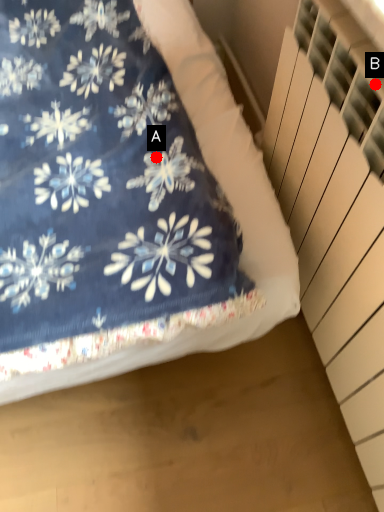
Question: Two points are circled on the image, labeled by A and B beside each circle. Which point appears closest to the camera in this image?

Choices:
 (A) A is closer
 (B) B is closer

Answer: (B)